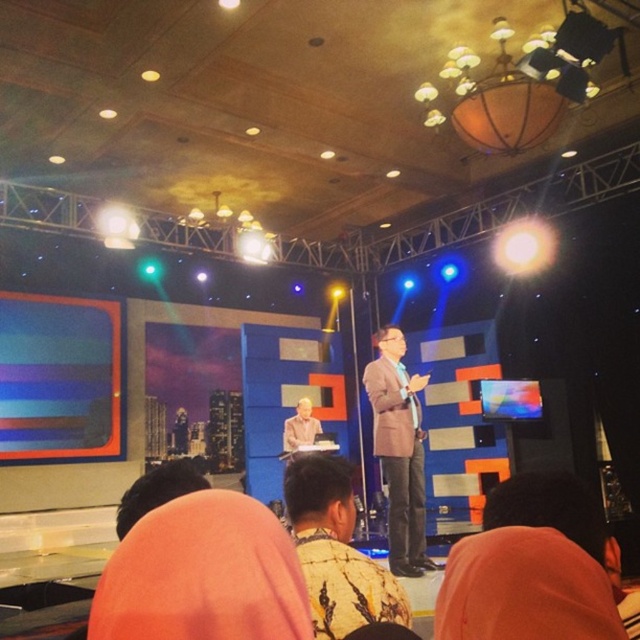
You are a photographer positioned at the camera. You need to capture a closeup shot of the patterned fabric shirt at center. Based on the scene description, is the shirt within the camera focus range of 60 centimeters? Please explain your answer.

The patterned fabric shirt at center is 64.87 centimeters from the camera. Since the focus range is 60 centimeters, the shirt is slightly beyond the recommended distance. To capture a clear closeup, the photographer should move closer to reduce the distance to within 60 centimeters.

You are an event organizer who needs to ensure that the brown textured suit at center and the orange fabric at lower right are visible to all audience members. Considering their sizes, which one might require a closer seat for better visibility?

The orange fabric at lower right has a smaller size compared to the brown textured suit at center, so audience members might need to sit closer to see it clearly.

You are an event coordinator planning to place a decorative banner on the stage. The banner is 2 meters tall. The banner needs to be placed above the brown textured suit at center but below the orange fabric at lower right. Is this placement possible?

The brown textured suit at center is below orange fabric at lower right, so placing the banner between them is possible as long as the banner fits vertically between their positions.